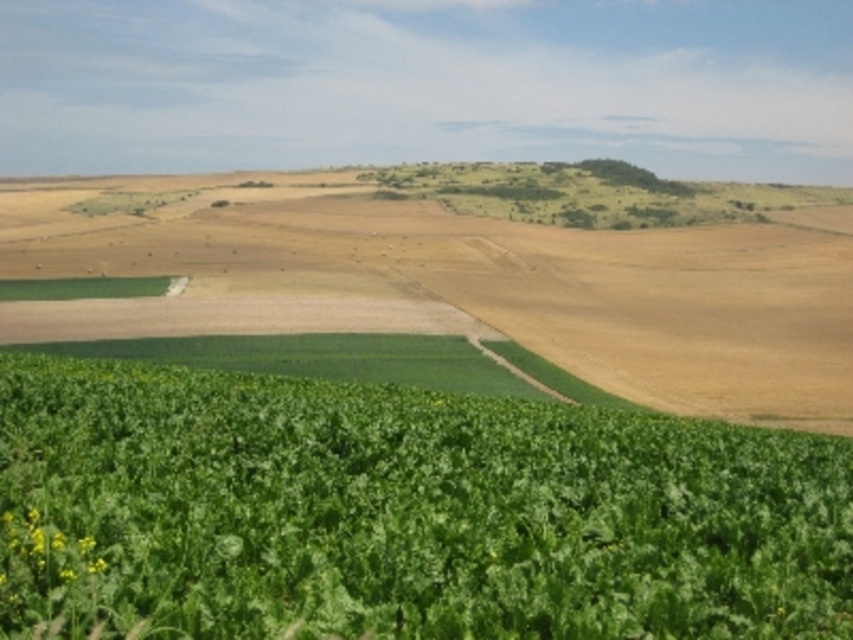
You are standing at the center of the agricultural landscape and want to locate the green leafy plant at lower left. According to the coordinates provided, in which direction should you look to find it?

The green leafy plant at lower left is located at coordinates point [401,513], so you should look to the lower left direction to find it.

You are a farmer inspecting your crops and notice a green leafy plant at lower left and a green leafy field at lower center. Which one covers a smaller area?

The green leafy plant at lower left covers a smaller area than the green leafy field at lower center.